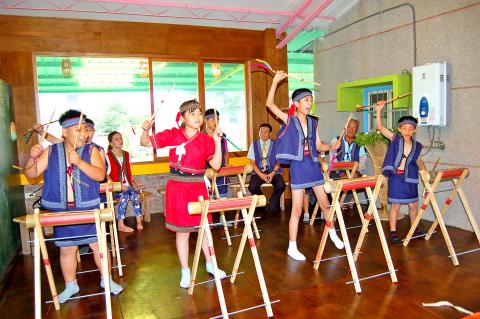
The image size is (480, 319). Identify the location of door. 368,95.